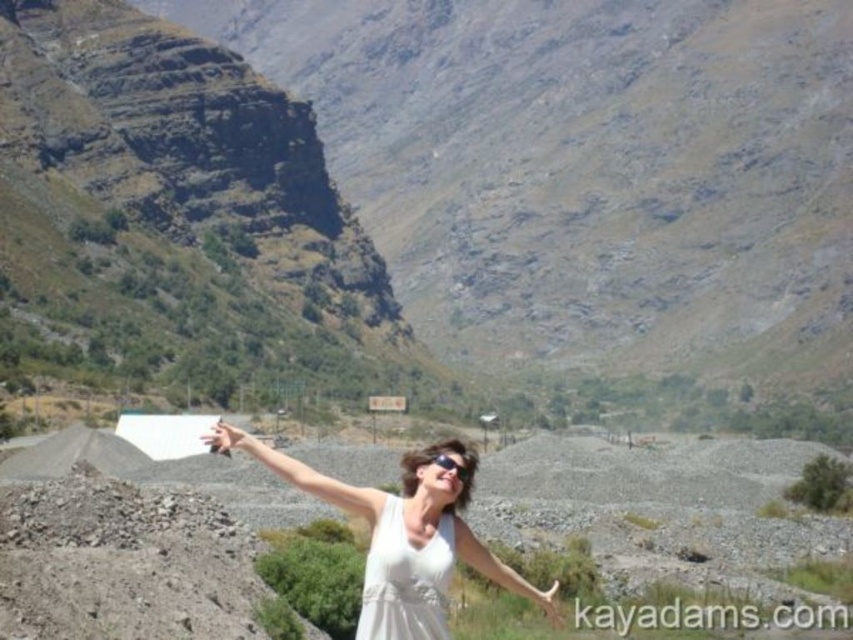
Does white matte dress at center have a smaller size compared to matte white hand at center?

Incorrect, white matte dress at center is not smaller in size than matte white hand at center.

Which is behind, point (432, 552) or point (552, 582)?

Point (552, 582)

In order to click on white matte dress at center in this screenshot , I will do `click(405, 579)`.

Between white matte hand at center and matte white hand at center, which one is positioned lower?

matte white hand at center is lower down.

Does white matte hand at center come in front of matte white hand at center?

Yes, it is in front of matte white hand at center.

This screenshot has width=853, height=640. What do you see at coordinates (221, 436) in the screenshot? I see `white matte hand at center` at bounding box center [221, 436].

Locate an element on the screen. white matte hand at center is located at coordinates (221, 436).

Can you confirm if white cotton dress at center is thinner than white matte hand at center?

No, white cotton dress at center is not thinner than white matte hand at center.

Does point (465, 496) lie in front of point (233, 433)?

No, it is not.

Describe the element at coordinates (403, 502) in the screenshot. This screenshot has height=640, width=853. I see `white cotton dress at center` at that location.

This screenshot has width=853, height=640. In order to click on white cotton dress at center in this screenshot , I will do `click(403, 502)`.